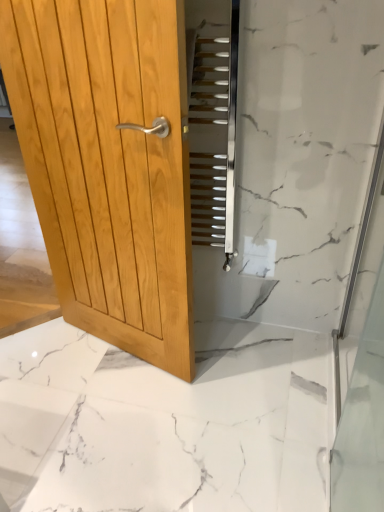
Question: Does transparent glass shower door at right have a smaller size compared to white marble floor at center?

Choices:
 (A) no
 (B) yes

Answer: (B)

Question: Is white marble floor at center at the back of transparent glass shower door at right?

Choices:
 (A) yes
 (B) no

Answer: (B)

Question: Does transparent glass shower door at right turn towards white marble floor at center?

Choices:
 (A) yes
 (B) no

Answer: (A)

Question: Is transparent glass shower door at right touching white marble floor at center?

Choices:
 (A) no
 (B) yes

Answer: (A)

Question: From the image's perspective, does transparent glass shower door at right appear lower than white marble floor at center?

Choices:
 (A) yes
 (B) no

Answer: (B)

Question: From a real-world perspective, is transparent glass shower door at right physically located above or below metallic silver stairs at center?

Choices:
 (A) below
 (B) above

Answer: (A)

Question: Choose the correct answer: Is transparent glass shower door at right inside metallic silver stairs at center or outside it?

Choices:
 (A) outside
 (B) inside

Answer: (A)

Question: In terms of width, does transparent glass shower door at right look wider or thinner when compared to metallic silver stairs at center?

Choices:
 (A) wide
 (B) thin

Answer: (B)

Question: From the image's perspective, is transparent glass shower door at right located above or below metallic silver stairs at center?

Choices:
 (A) below
 (B) above

Answer: (A)

Question: Is light brown wood door at left taller or shorter than white marble floor at center?

Choices:
 (A) tall
 (B) short

Answer: (A)

Question: Is light brown wood door at left situated inside white marble floor at center or outside?

Choices:
 (A) outside
 (B) inside

Answer: (A)

Question: Visually, is light brown wood door at left positioned to the left or to the right of white marble floor at center?

Choices:
 (A) right
 (B) left

Answer: (B)

Question: Is light brown wood door at left bigger or smaller than white marble floor at center?

Choices:
 (A) small
 (B) big

Answer: (A)

Question: Is metallic silver stairs at center wider or thinner than transparent glass shower door at right?

Choices:
 (A) thin
 (B) wide

Answer: (B)

Question: In terms of size, does metallic silver stairs at center appear bigger or smaller than transparent glass shower door at right?

Choices:
 (A) small
 (B) big

Answer: (A)